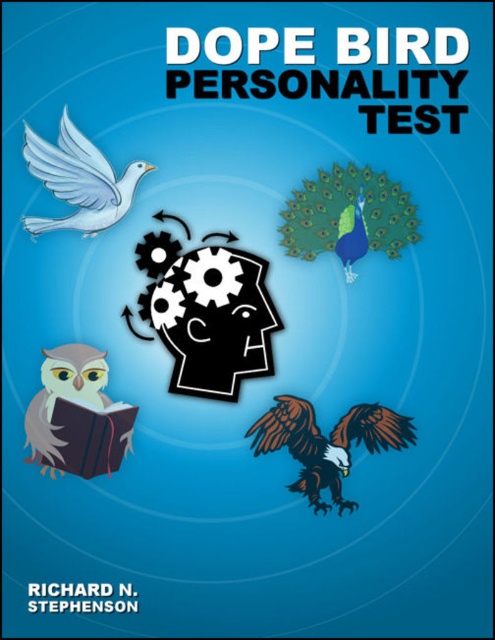
You are designing a book cover and want to place a white matte dove at upper left and a hardcover book at lower left. Considering their sizes, which one would be more eye catching from a distance?

The white matte dove at upper left is much taller than the hardcover book at lower left, so it would be more eye catching from a distance due to its larger size.

You are standing 1.5 meters away from the book cover. If you want to touch the point at coordinate point (115, 221), will you be able to reach it without moving closer?

The distance of point (115, 221) from the camera is 1.26 meters, so you are currently 1.5 meters away. Since 1.5 meters is further than 1.26 meters, you would need to move closer to reach the point.

You are holding the hardcover book at lower left and want to place it on a shelf. However, there is a white matte dove at upper left above it. Can you move the book without disturbing the dove?

The white matte dove at upper left is positioned over the hardcover book at lower left, so moving the book may cause the dove to shift as well. Carefully slide the book out from under the dove to avoid disturbing it.